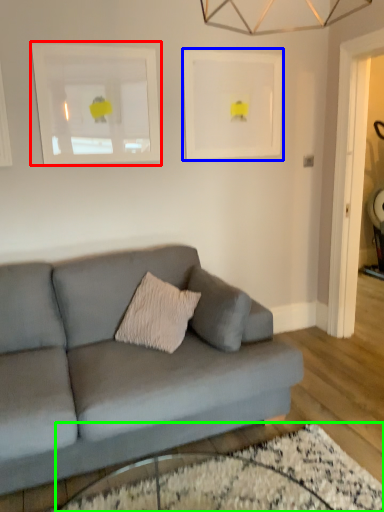
Question: Considering the real-world distances, which object is farthest from picture frame (highlighted by a red box)? picture frame (highlighted by a blue box) or glass table (highlighted by a green box)?

Choices:
 (A) picture frame
 (B) glass table

Answer: (B)